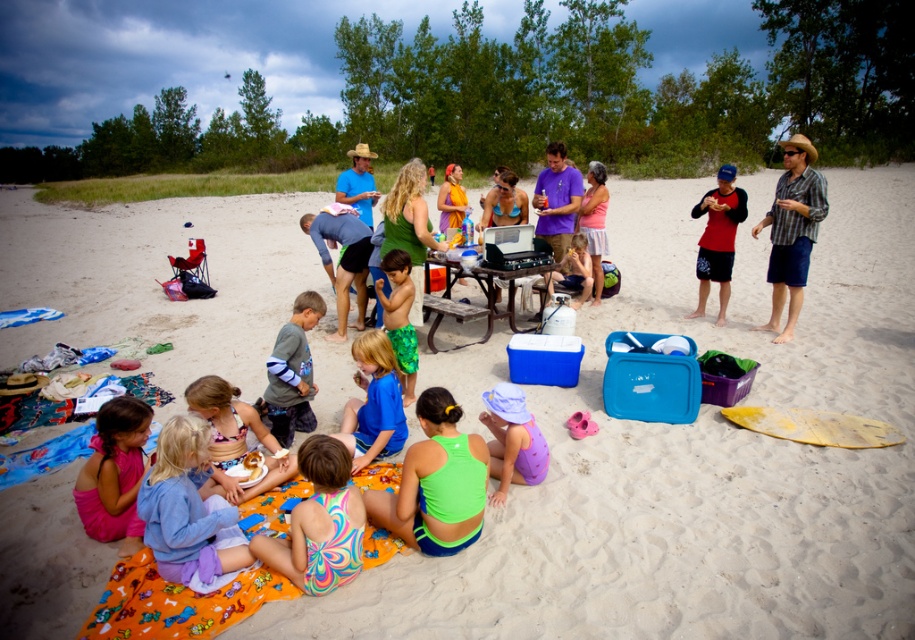
Question: Does blue matte shirt at center have a larger size compared to green textured shorts at center?

Choices:
 (A) yes
 (B) no

Answer: (B)

Question: Does multicolored swimsuit at center have a larger size compared to blue matte shirt at center?

Choices:
 (A) yes
 (B) no

Answer: (B)

Question: Which point is farther to the camera?

Choices:
 (A) (203, 493)
 (B) (493, 467)

Answer: (B)

Question: Which object is the farthest from the purple swimsuit at lower center?

Choices:
 (A) pink fabric dress at center
 (B) pastel blue sweater at lower left
 (C) pink fabric dress at lower left

Answer: (A)

Question: Is pastel blue sweater at lower left further to camera compared to blue swim trunks at center?

Choices:
 (A) no
 (B) yes

Answer: (A)

Question: Which point is farther to the camera?

Choices:
 (A) pastel blue sweater at lower left
 (B) purple swimsuit at lower center

Answer: (B)